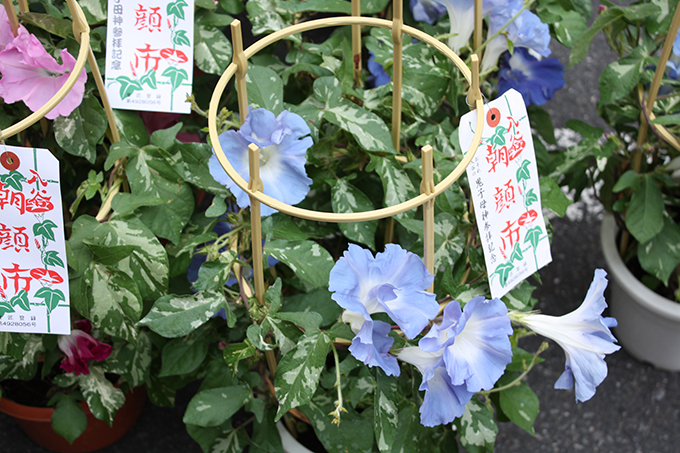
Find the location of a particular element. This screenshot has height=453, width=680. terra cotta pot is located at coordinates (97, 425).